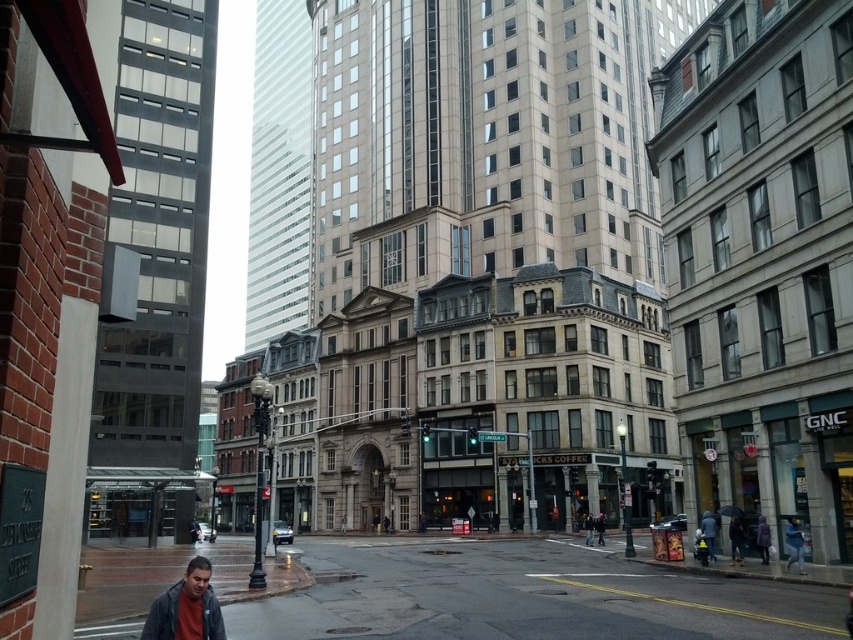
Which is more to the left, dark gray asphalt at lower center or dark blue jacket at lower right?

Positioned to the left is dark gray asphalt at lower center.

Is point (566, 560) in front of point (738, 548)?

No, it is not.

The width and height of the screenshot is (853, 640). I want to click on dark gray asphalt at lower center, so click(x=515, y=595).

How distant is dark blue jacket at lower right from purple matte coat at lower right?

dark blue jacket at lower right and purple matte coat at lower right are 1.46 meters apart.

This screenshot has height=640, width=853. I want to click on dark blue jacket at lower right, so click(x=735, y=538).

Describe the element at coordinates (735, 538) in the screenshot. I see `dark blue jacket at lower right` at that location.

Identify the location of dark blue jacket at lower right. This screenshot has width=853, height=640. (735, 538).

Which is more to the right, dark gray asphalt at lower center or purple matte coat at lower right?

purple matte coat at lower right is more to the right.

Consider the image. Does dark gray asphalt at lower center have a greater height compared to purple matte coat at lower right?

Yes.

Who is more distant from viewer, (494, 577) or (767, 538)?

The point (494, 577) is more distant.

What are the coordinates of `dark gray asphalt at lower center` in the screenshot? It's located at (515, 595).